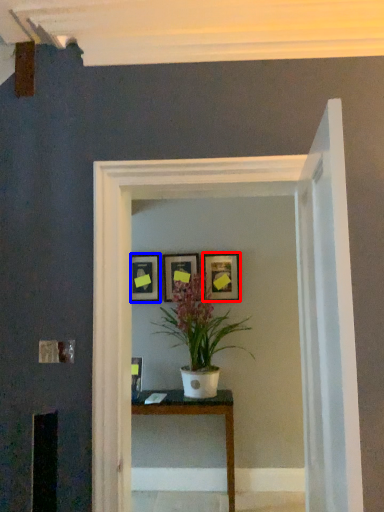
Question: Among these objects, which one is farthest to the camera, picture frame (highlighted by a red box) or picture frame (highlighted by a blue box)?

Choices:
 (A) picture frame
 (B) picture frame

Answer: (B)